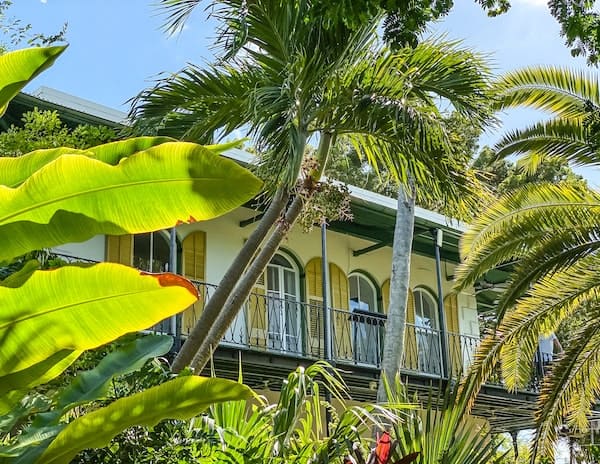
Find the location of `support poles`. support poles is located at coordinates (327, 272), (440, 288), (174, 262).